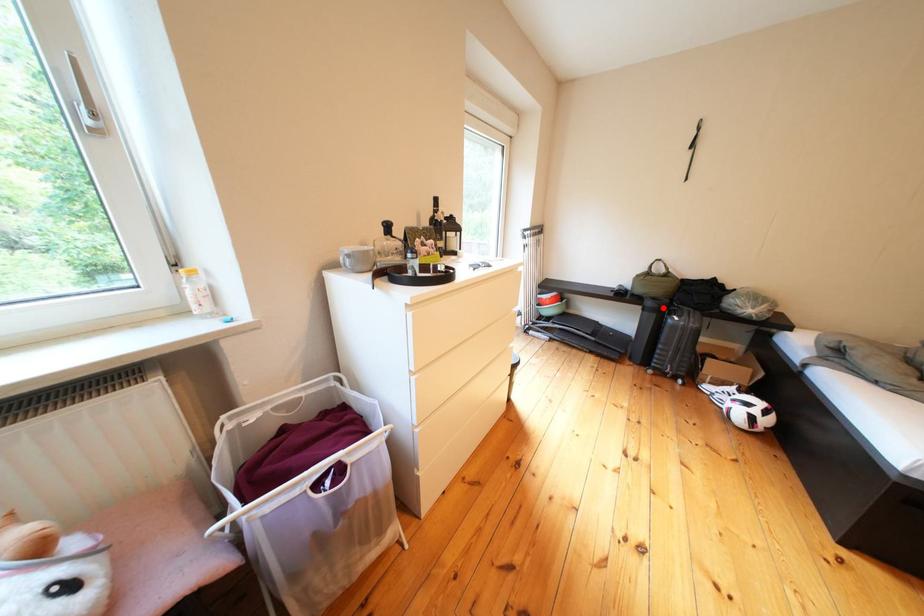
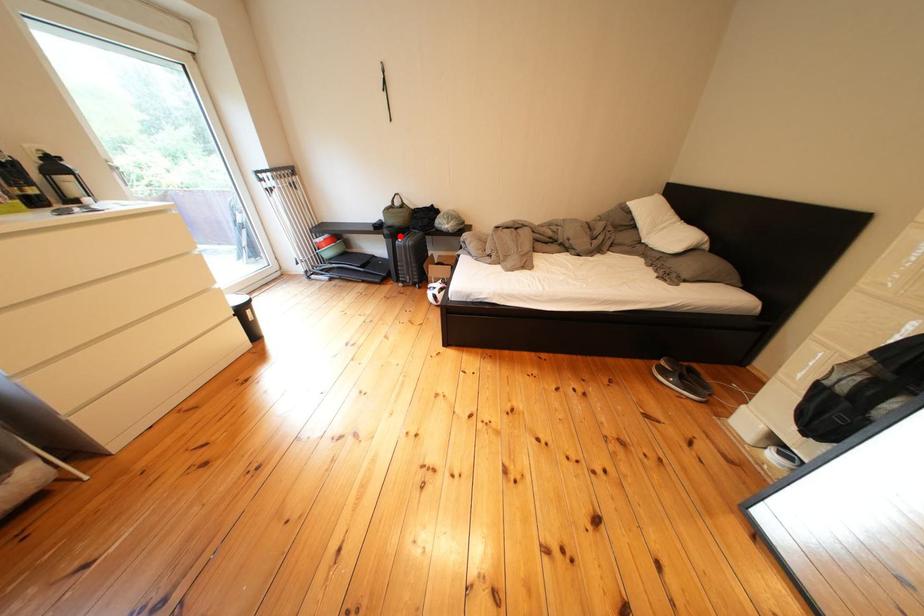
I am providing you with two images of the same scene from different viewpoints. A red point is marked on the first image and another point is marked on the second image. Do the highlighted points in image1 and image2 indicate the same real-world spot?

Yes